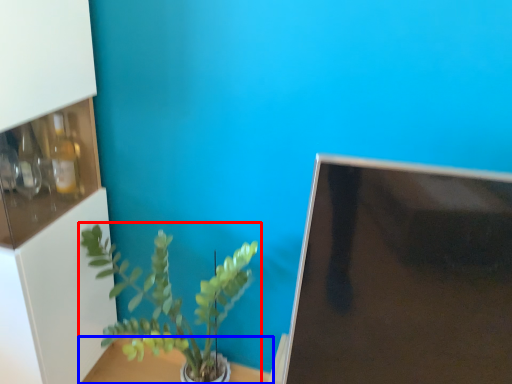
Question: Which of the following is the farthest to the observer, houseplant (highlighted by a red box) or table (highlighted by a blue box)?

Choices:
 (A) houseplant
 (B) table

Answer: (B)